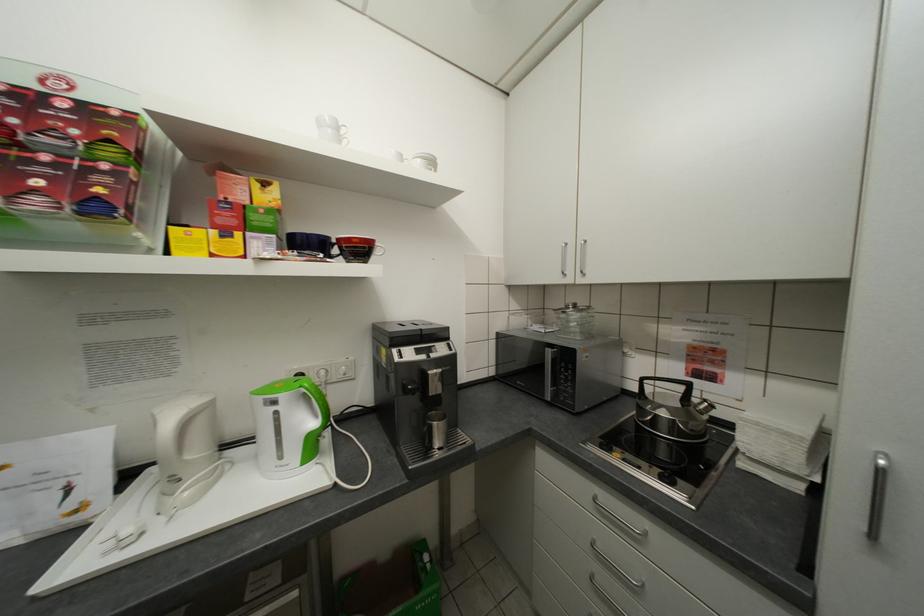
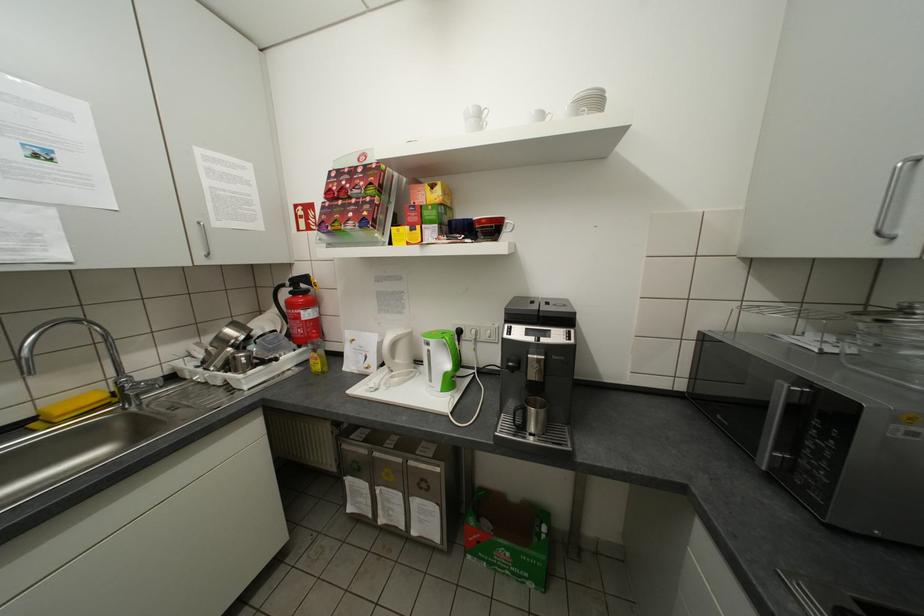
Find the pixel in the second image that matches pixel 338 130 in the first image.

(481, 120)